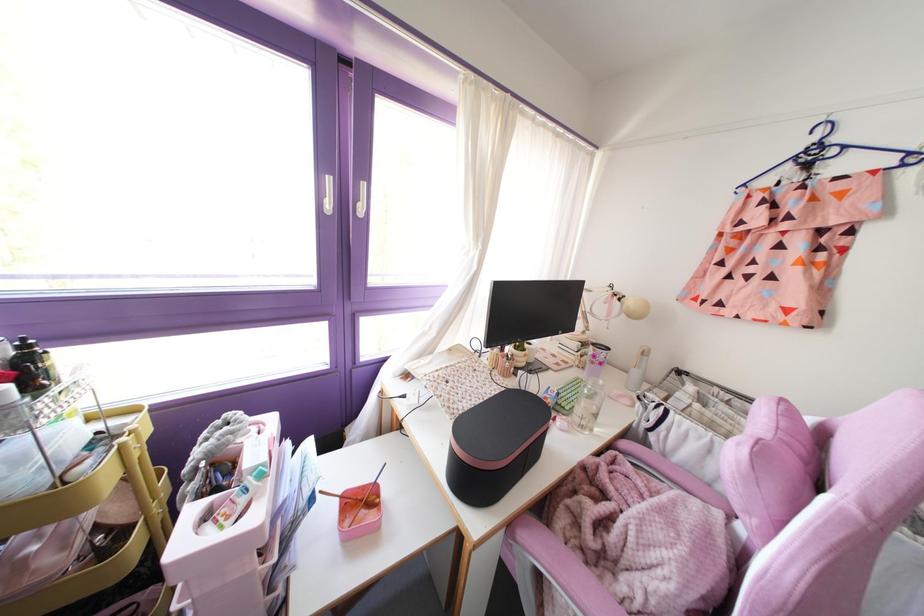
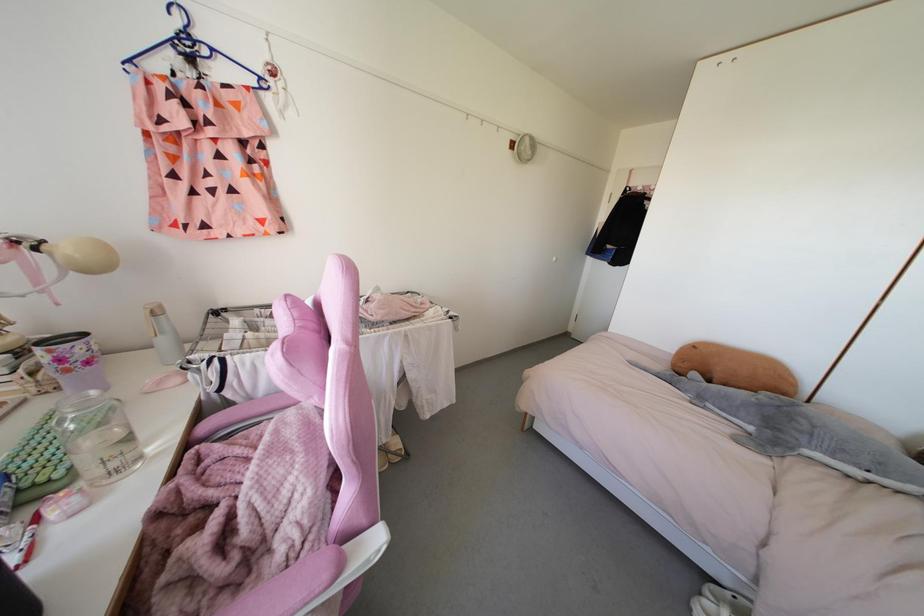
Where in the second image is the point corresponding to the point at 800,177 from the first image?

(191, 73)